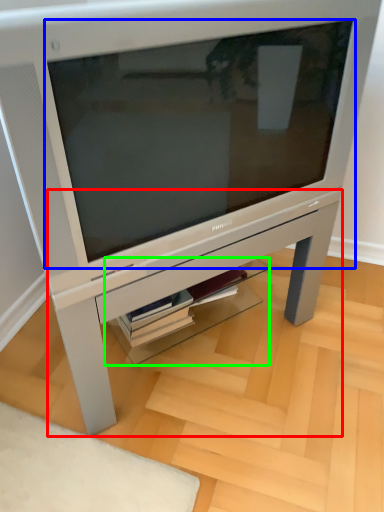
Question: Estimate the real-world distances between objects in this image. Which object is farther from table (highlighted by a red box), computer monitor (highlighted by a blue box) or shelf (highlighted by a green box)?

Choices:
 (A) computer monitor
 (B) shelf

Answer: (A)